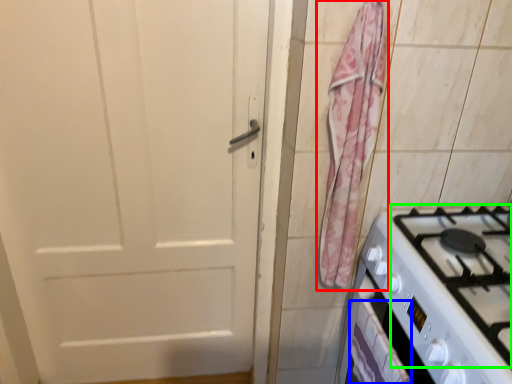
Question: Which object is the farthest from curtain (highlighted by a red box)? Choose among these: drawer (highlighted by a blue box) or gas stove (highlighted by a green box).

Choices:
 (A) drawer
 (B) gas stove

Answer: (A)